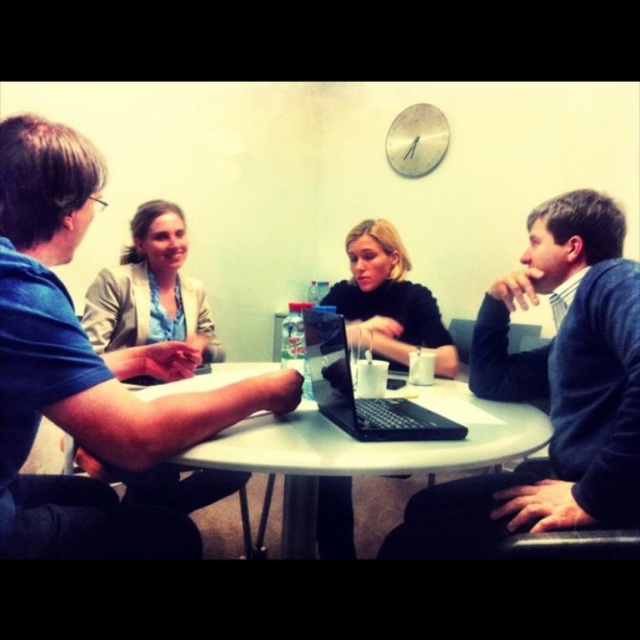
Question: Which point is farther to the camera?

Choices:
 (A) (22, 486)
 (B) (170, 291)

Answer: (B)

Question: Which point is closer to the camera taking this photo?

Choices:
 (A) (196, 339)
 (B) (506, 401)

Answer: (B)

Question: From the image, what is the correct spatial relationship of blue matte shirt at upper left in relation to dark blue sweater at right?

Choices:
 (A) left
 (B) right

Answer: (A)

Question: Where is blue matte shirt at upper left located in relation to black matte sweater at center in the image?

Choices:
 (A) below
 (B) above

Answer: (A)

Question: Is black matte sweater at center smaller than black matte laptop at center?

Choices:
 (A) no
 (B) yes

Answer: (A)

Question: Which point is farther from the camera taking this photo?

Choices:
 (A) (307, 355)
 (B) (170, 202)
 (C) (422, 326)

Answer: (B)